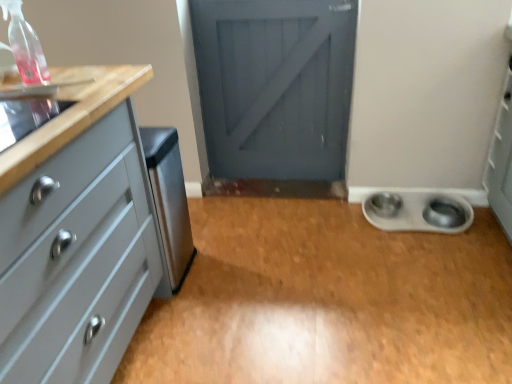
Locate an element on the screen. The height and width of the screenshot is (384, 512). vacant area that is in front of metallic silver bowl at lower right is located at coordinates (393, 231).